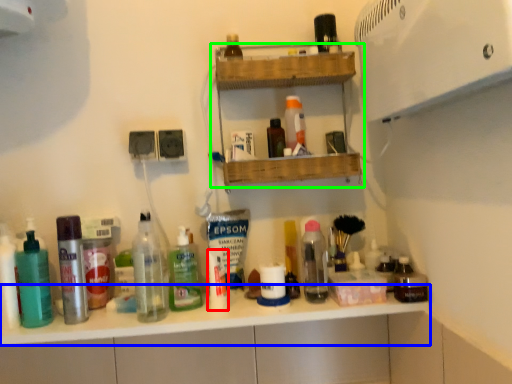
Question: Considering the real-world distances, which object is closest to toiletry (highlighted by a red box)? counter top (highlighted by a blue box) or shelf (highlighted by a green box).

Choices:
 (A) counter top
 (B) shelf

Answer: (A)